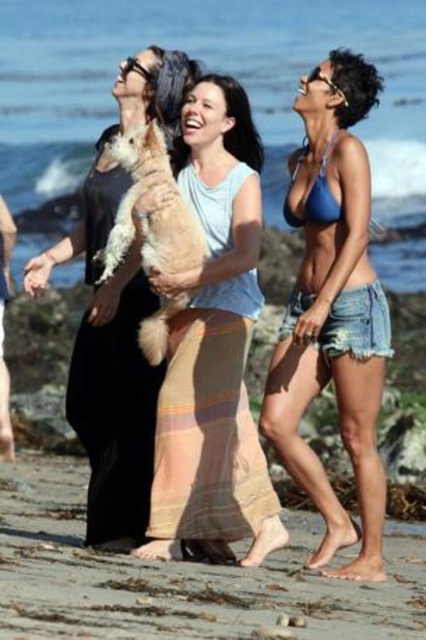
Based on the photo, between blue denim shorts at center and white fluffy dog at center, which one appears on the right side from the viewer's perspective?

From the viewer's perspective, blue denim shorts at center appears more on the right side.

Between blue denim shorts at center and white fluffy dog at center, which one is positioned higher?

white fluffy dog at center

Describe the element at coordinates (333, 310) in the screenshot. The width and height of the screenshot is (426, 640). I see `blue denim shorts at center` at that location.

Identify the location of blue denim shorts at center. This screenshot has width=426, height=640. (333, 310).

Who is positioned more to the right, smooth sand at lower center or matte beige skirt at center?

Positioned to the right is smooth sand at lower center.

Can you confirm if smooth sand at lower center is shorter than matte beige skirt at center?

Yes, smooth sand at lower center is shorter than matte beige skirt at center.

Which is in front, point (66, 550) or point (207, 84)?

Point (66, 550) is more forward.

I want to click on smooth sand at lower center, so click(x=181, y=577).

Which of these two, smooth sand at lower center or white fluffy dog at center, stands shorter?

smooth sand at lower center

Can you confirm if smooth sand at lower center is taller than white fluffy dog at center?

In fact, smooth sand at lower center may be shorter than white fluffy dog at center.

Between point (207, 582) and point (172, 305), which one is positioned behind?

The point (172, 305) is more distant.

This screenshot has width=426, height=640. Find the location of `smooth sand at lower center`. smooth sand at lower center is located at coordinates (181, 577).